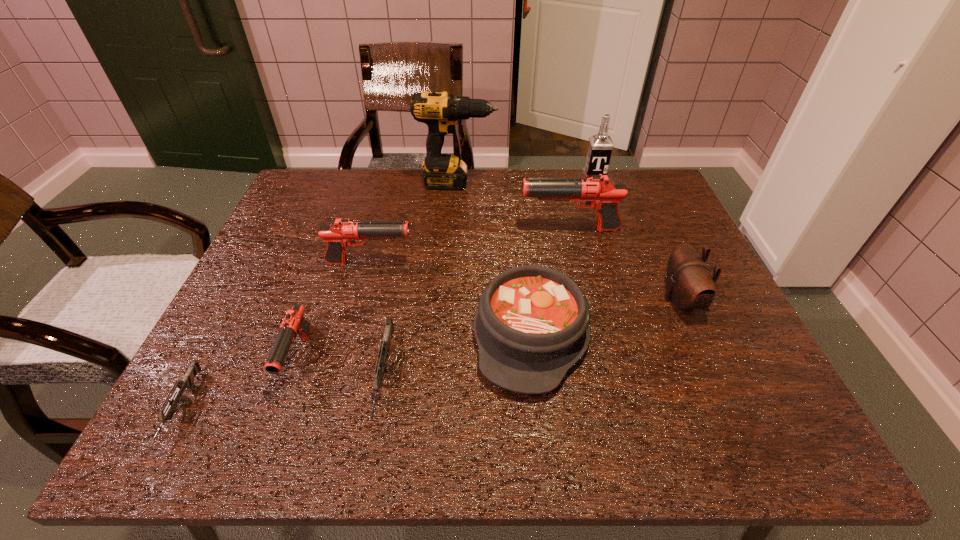
Identify the location of the nearest black gun. (294, 323).

The image size is (960, 540). Identify the location of the smallest black gun. (294, 323).

Find the location of `the bigger grey gun`. the bigger grey gun is located at coordinates (381, 368).

Find the location of a particular element. This screenshot has width=960, height=540. the second shortest object is located at coordinates (381, 368).

What are the coordinates of `the shortest object` in the screenshot? It's located at (187, 382).

Find the location of a particular element. This screenshot has height=540, width=960. the smaller grey gun is located at coordinates (187, 382).

The width and height of the screenshot is (960, 540). I want to click on free location located 0.390m at the tip of the black drill, so click(x=622, y=183).

The width and height of the screenshot is (960, 540). What are the coordinates of `vacant space situated on the front label of the second tallest object` in the screenshot? It's located at (617, 241).

This screenshot has height=540, width=960. Identify the location of free space located 0.380m at the aiming end of the farthest gun. (380, 230).

You are a GUI agent. You are given a task and a screenshot of the screen. Output one action in this format:
    pyautogui.click(x=<x>, y=<y>)
    Task: Click on the vacant space situated at the aiming end of the farthest gun
    
    Given the screenshot: What is the action you would take?
    pyautogui.click(x=461, y=230)